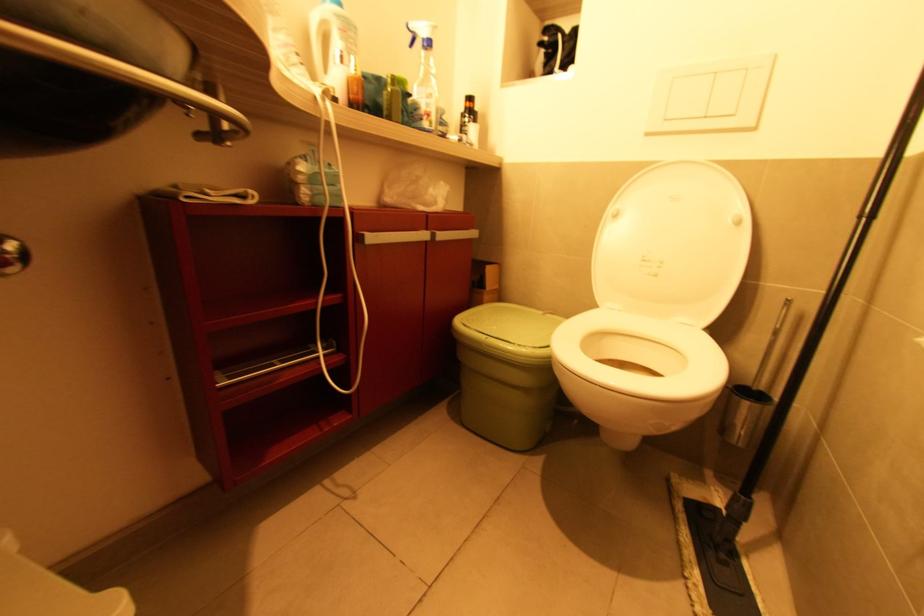
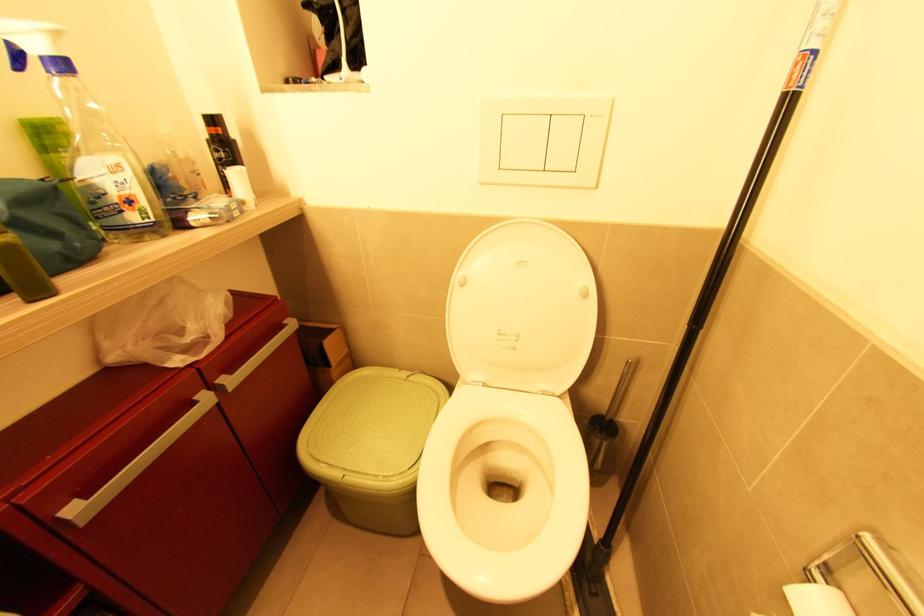
Which direction would the cameraman need to move to produce the second image?

The cameraman walked toward right, forward.